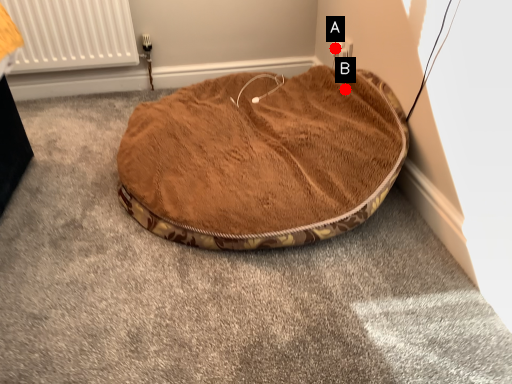
Question: Two points are circled on the image, labeled by A and B beside each circle. Which point appears closest to the camera in this image?

Choices:
 (A) A is closer
 (B) B is closer

Answer: (B)